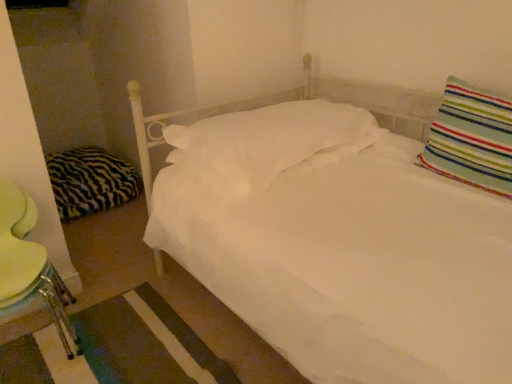
What do you see at coordinates (90, 181) in the screenshot? I see `zebra-patterned fabric pillow at left, the first pillow positioned from the back` at bounding box center [90, 181].

In order to click on zebra-patterned fabric pillow at left, the third pillow in the right-to-left sequence in this screenshot , I will do `click(90, 181)`.

The width and height of the screenshot is (512, 384). Find the location of `zebra-patterned fabric pillow at left, marked as the 3th pillow in a front-to-back arrangement`. zebra-patterned fabric pillow at left, marked as the 3th pillow in a front-to-back arrangement is located at coordinates (90, 181).

Is striped fabric pillow at upper right, the first pillow when ordered from right to left, next to metallic green swivel chair at lower left?

There is a gap between striped fabric pillow at upper right, the first pillow when ordered from right to left, and metallic green swivel chair at lower left.

Does striped fabric pillow at upper right, which is counted as the 3th pillow, starting from the back, have a greater width compared to metallic green swivel chair at lower left?

In fact, striped fabric pillow at upper right, which is counted as the 3th pillow, starting from the back, might be narrower than metallic green swivel chair at lower left.

In the scene shown: Is striped fabric pillow at upper right, the 1th pillow in the front-to-back sequence, outside of metallic green swivel chair at lower left?

striped fabric pillow at upper right, the 1th pillow in the front-to-back sequence, is positioned outside metallic green swivel chair at lower left.

Is striped fabric pillow at upper right, the 1th pillow in the front-to-back sequence, facing away from white soft pillow at center, the 2th pillow viewed from the back?

No, striped fabric pillow at upper right, the 1th pillow in the front-to-back sequence, is not facing away from white soft pillow at center, the 2th pillow viewed from the back.

Can you see striped fabric pillow at upper right, the 1th pillow in the front-to-back sequence, touching white soft pillow at center, which ranks as the second pillow in right-to-left order?

No, striped fabric pillow at upper right, the 1th pillow in the front-to-back sequence, is not with white soft pillow at center, which ranks as the second pillow in right-to-left order.

Does point (480, 100) come in front of point (194, 156)?

Yes, it is.

Can you confirm if striped fabric pillow at upper right, the 1th pillow in the front-to-back sequence, is thinner than white soft pillow at center, which ranks as the second pillow in right-to-left order?

Correct, the width of striped fabric pillow at upper right, the 1th pillow in the front-to-back sequence, is less than that of white soft pillow at center, which ranks as the second pillow in right-to-left order.

Is zebra-patterned fabric pillow at left, the third pillow in the right-to-left sequence, bigger than striped fabric pillow at upper right, the first pillow when ordered from right to left?

Indeed, zebra-patterned fabric pillow at left, the third pillow in the right-to-left sequence, has a larger size compared to striped fabric pillow at upper right, the first pillow when ordered from right to left.

How many degrees apart are the facing directions of zebra-patterned fabric pillow at left, acting as the 1th pillow starting from the left, and striped fabric pillow at upper right, which is counted as the 3th pillow, starting from the back?

The angle between the facing direction of zebra-patterned fabric pillow at left, acting as the 1th pillow starting from the left, and the facing direction of striped fabric pillow at upper right, which is counted as the 3th pillow, starting from the back, is 90.5 degrees.

Which object is positioned more to the right, zebra-patterned fabric pillow at left, acting as the 1th pillow starting from the left, or striped fabric pillow at upper right, the 1th pillow in the front-to-back sequence?

Positioned to the right is striped fabric pillow at upper right, the 1th pillow in the front-to-back sequence.

Is zebra-patterned fabric pillow at left, the first pillow positioned from the back, touching striped fabric pillow at upper right, which is counted as the 3th pillow, starting from the back?

There is a gap between zebra-patterned fabric pillow at left, the first pillow positioned from the back, and striped fabric pillow at upper right, which is counted as the 3th pillow, starting from the back.

Does metallic green swivel chair at lower left have a greater width compared to zebra-patterned fabric pillow at left, marked as the 3th pillow in a front-to-back arrangement?

No, metallic green swivel chair at lower left is not wider than zebra-patterned fabric pillow at left, marked as the 3th pillow in a front-to-back arrangement.

How different are the orientations of metallic green swivel chair at lower left and zebra-patterned fabric pillow at left, the first pillow positioned from the back, in degrees?

metallic green swivel chair at lower left and zebra-patterned fabric pillow at left, the first pillow positioned from the back, are facing 0.398 degrees away from each other.

Is metallic green swivel chair at lower left to the left of zebra-patterned fabric pillow at left, the third pillow in the right-to-left sequence, from the viewer's perspective?

Incorrect, metallic green swivel chair at lower left is not on the left side of zebra-patterned fabric pillow at left, the third pillow in the right-to-left sequence.

From the picture: Considering the positions of objects metallic green swivel chair at lower left and striped fabric pillow at upper right, which is counted as the 3th pillow, starting from the back, in the image provided, who is more to the left, metallic green swivel chair at lower left or striped fabric pillow at upper right, which is counted as the 3th pillow, starting from the back,?

Positioned to the left is metallic green swivel chair at lower left.

Can you confirm if metallic green swivel chair at lower left is smaller than striped fabric pillow at upper right, which is counted as the 3th pillow, starting from the back?

No.

Does point (8, 303) lie behind point (494, 162)?

That is False.

Is metallic green swivel chair at lower left not within striped fabric pillow at upper right, the first pillow when ordered from right to left?

Yes.

Is zebra-patterned fabric pillow at left, the third pillow in the right-to-left sequence, further to the viewer compared to metallic green swivel chair at lower left?

Yes, it is.

Are zebra-patterned fabric pillow at left, the third pillow in the right-to-left sequence, and metallic green swivel chair at lower left far apart?

Absolutely, zebra-patterned fabric pillow at left, the third pillow in the right-to-left sequence, is distant from metallic green swivel chair at lower left.

Which is closer, (x=131, y=171) or (x=16, y=228)?

Point (x=131, y=171) appears to be farther away from the viewer than point (x=16, y=228).

Could you tell me if zebra-patterned fabric pillow at left, the third pillow in the right-to-left sequence, is turned towards metallic green swivel chair at lower left?

Yes, zebra-patterned fabric pillow at left, the third pillow in the right-to-left sequence, is turned towards metallic green swivel chair at lower left.

Which is nearer, [177,142] or [66,211]?

The point [177,142] is closer to the camera.

In terms of size, does white soft pillow at center, placed as the 2th pillow when sorted from left to right, appear bigger or smaller than zebra-patterned fabric pillow at left, the third pillow in the right-to-left sequence?

Considering their sizes, white soft pillow at center, placed as the 2th pillow when sorted from left to right, takes up more space than zebra-patterned fabric pillow at left, the third pillow in the right-to-left sequence.

From the image's perspective, count 2nd pillows upward from the zebra-patterned fabric pillow at left, the third pillow in the right-to-left sequence, and point to it. Please provide its 2D coordinates.

[(267, 143)]

Which object is further away from the camera taking this photo, white soft pillow at center, the 2th pillow when ordered from front to back, or zebra-patterned fabric pillow at left, acting as the 1th pillow starting from the left?

zebra-patterned fabric pillow at left, acting as the 1th pillow starting from the left, is more distant.

Where is `swivel chair on the left of the striped fabric pillow at upper right, the 1th pillow in the front-to-back sequence`? This screenshot has width=512, height=384. swivel chair on the left of the striped fabric pillow at upper right, the 1th pillow in the front-to-back sequence is located at coordinates (29, 264).

The image size is (512, 384). What are the coordinates of `pillow that appears above the striped fabric pillow at upper right, which is counted as the 3th pillow, starting from the back (from the image's perspective)` in the screenshot? It's located at (267, 143).

Based on their spatial positions, is zebra-patterned fabric pillow at left, acting as the 1th pillow starting from the left, or striped fabric pillow at upper right, the first pillow when ordered from right to left, closer to metallic green swivel chair at lower left?

zebra-patterned fabric pillow at left, acting as the 1th pillow starting from the left, is positioned closer to the anchor metallic green swivel chair at lower left.

Considering their positions, is striped fabric pillow at upper right, which appears as the third pillow when viewed from the left, positioned further to metallic green swivel chair at lower left than white soft pillow at center, the 2th pillow viewed from the back?

Based on the image, striped fabric pillow at upper right, which appears as the third pillow when viewed from the left, appears to be further to metallic green swivel chair at lower left.

Which object lies further to the anchor point striped fabric pillow at upper right, the 1th pillow in the front-to-back sequence, white soft pillow at center, the 2th pillow when ordered from front to back, or metallic green swivel chair at lower left?

The object further to striped fabric pillow at upper right, the 1th pillow in the front-to-back sequence, is metallic green swivel chair at lower left.

Based on their spatial positions, is striped fabric pillow at upper right, the first pillow when ordered from right to left, or white soft pillow at center, which ranks as the second pillow in right-to-left order, closer to zebra-patterned fabric pillow at left, acting as the 1th pillow starting from the left?

Based on the image, white soft pillow at center, which ranks as the second pillow in right-to-left order, appears to be nearer to zebra-patterned fabric pillow at left, acting as the 1th pillow starting from the left.

Estimate the real-world distances between objects in this image. Which object is closer to white soft pillow at center, which ranks as the second pillow in right-to-left order, zebra-patterned fabric pillow at left, acting as the 1th pillow starting from the left, or striped fabric pillow at upper right, which is counted as the 3th pillow, starting from the back?

striped fabric pillow at upper right, which is counted as the 3th pillow, starting from the back, is positioned closer to the anchor white soft pillow at center, which ranks as the second pillow in right-to-left order.

Considering their positions, is metallic green swivel chair at lower left positioned further to zebra-patterned fabric pillow at left, acting as the 1th pillow starting from the left, than white soft pillow at center, the 2th pillow when ordered from front to back?

white soft pillow at center, the 2th pillow when ordered from front to back, is positioned further to the anchor zebra-patterned fabric pillow at left, acting as the 1th pillow starting from the left.

Which object lies further to the anchor point metallic green swivel chair at lower left, white soft pillow at center, placed as the 2th pillow when sorted from left to right, or striped fabric pillow at upper right, the 1th pillow in the front-to-back sequence?

The object further to metallic green swivel chair at lower left is striped fabric pillow at upper right, the 1th pillow in the front-to-back sequence.

Which object lies further to the anchor point white soft pillow at center, placed as the 2th pillow when sorted from left to right, metallic green swivel chair at lower left or striped fabric pillow at upper right, which is counted as the 3th pillow, starting from the back?

The object further to white soft pillow at center, placed as the 2th pillow when sorted from left to right, is metallic green swivel chair at lower left.

The width and height of the screenshot is (512, 384). Find the location of `pillow located between zebra-patterned fabric pillow at left, marked as the 3th pillow in a front-to-back arrangement, and striped fabric pillow at upper right, the first pillow when ordered from right to left, in the left-right direction`. pillow located between zebra-patterned fabric pillow at left, marked as the 3th pillow in a front-to-back arrangement, and striped fabric pillow at upper right, the first pillow when ordered from right to left, in the left-right direction is located at coordinates (267, 143).

What are the coordinates of `swivel chair between zebra-patterned fabric pillow at left, marked as the 3th pillow in a front-to-back arrangement, and striped fabric pillow at upper right, the 1th pillow in the front-to-back sequence, in the horizontal direction` in the screenshot? It's located at (29, 264).

Locate an element on the screen. Image resolution: width=512 pixels, height=384 pixels. pillow located between metallic green swivel chair at lower left and striped fabric pillow at upper right, the 1th pillow in the front-to-back sequence, in the left-right direction is located at coordinates (267, 143).